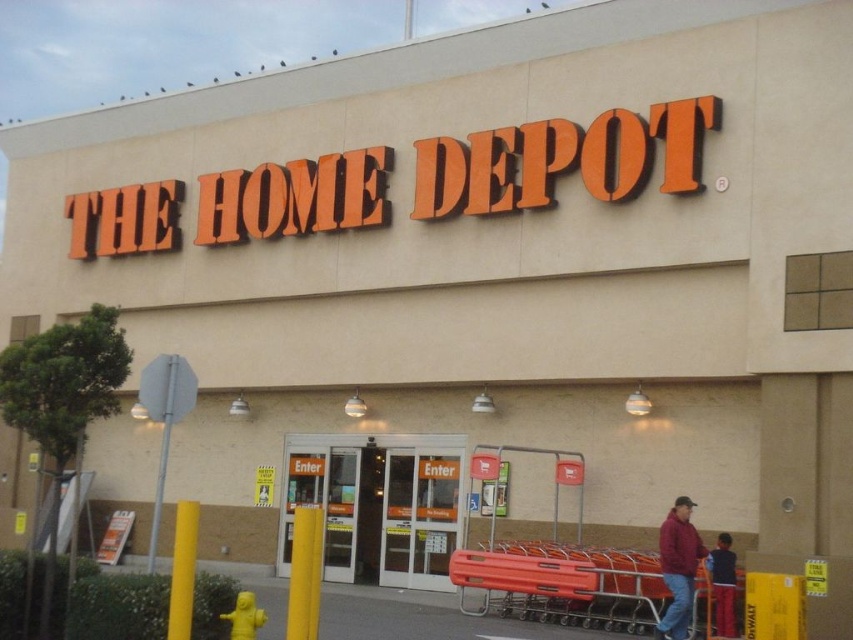
Can you confirm if clear glass doors at center is smaller than dark blue jeans at lower right?

Incorrect, clear glass doors at center is not smaller in size than dark blue jeans at lower right.

Locate an element on the screen. Image resolution: width=853 pixels, height=640 pixels. clear glass doors at center is located at coordinates (376, 506).

Does maroon fabric jacket at lower right have a lesser width compared to dark blue jeans at lower right?

Incorrect, maroon fabric jacket at lower right's width is not less than dark blue jeans at lower right's.

Is point (682, 592) positioned after point (724, 616)?

No, it is not.

Which is behind, point (694, 529) or point (724, 595)?

Positioned behind is point (694, 529).

Identify the location of maroon fabric jacket at lower right. (677, 566).

Which of these two, clear glass doors at center or maroon fabric jacket at lower right, stands shorter?

maroon fabric jacket at lower right

Is point (413, 564) closer to viewer compared to point (697, 563)?

No, (413, 564) is behind (697, 563).

This screenshot has width=853, height=640. Identify the location of clear glass doors at center. (376, 506).